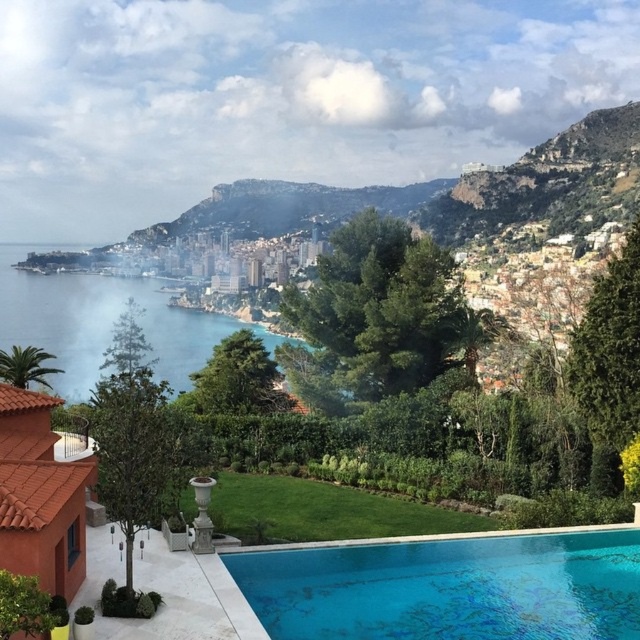
You are a drone operator tasked with capturing aerial footage of the coastal scene. You need to ensure that both the blue glassy swimming pool at lower center and the clear blue water at center are visible in your shot. Given that your drone can capture a maximum horizontal distance of 120 meters in a single frame, will you be able to include both objects in the same frame?

The blue glassy swimming pool at lower center and clear blue water at center are 116.95 meters apart. Since the drone can capture up to 120 meters in a single frame, both objects can be included in the same shot as their separation is within the drone camera range.

Consider the image. You are standing at the center of the garden and want to locate the blue glassy swimming pool at lower center. According to the coordinates provided, in which direction should you move to reach it?

The blue glassy swimming pool at lower center is located at coordinates 0.920 on the x axis and 0.703 on the y axis. Since you are at the center, moving towards the lower right direction would lead you to the blue glassy swimming pool at lower center.

You are a landscape architect designing a new garden. You need to place a statue that requires a base height of 1 meter. Given the blue glassy swimming pool at lower center and the clear blue water at center, which one can accommodate the statue base without it being submerged?

The blue glassy swimming pool at lower center has a lesser height compared to clear blue water at center, so the statue base of 1 meter can be placed on the blue glassy swimming pool at lower center without being submerged.